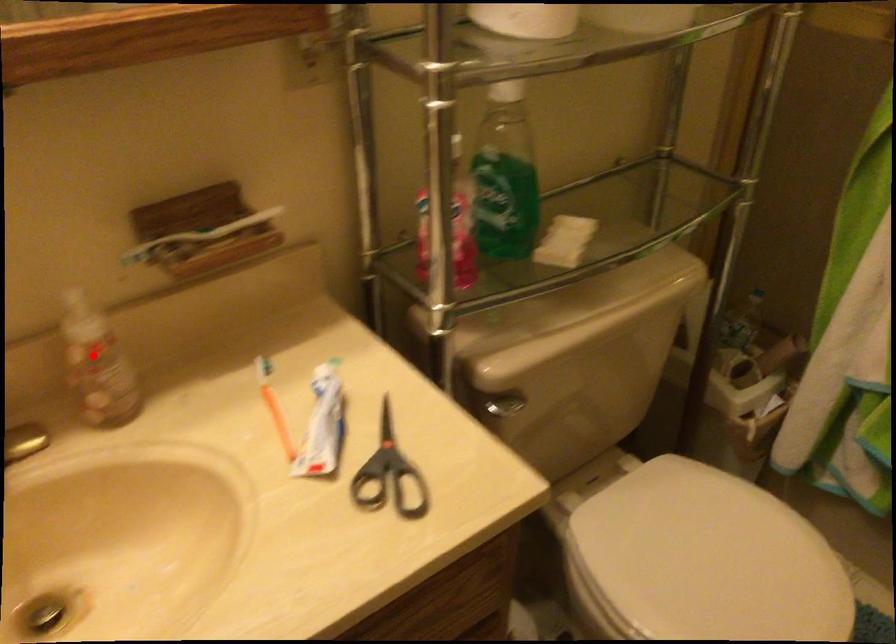
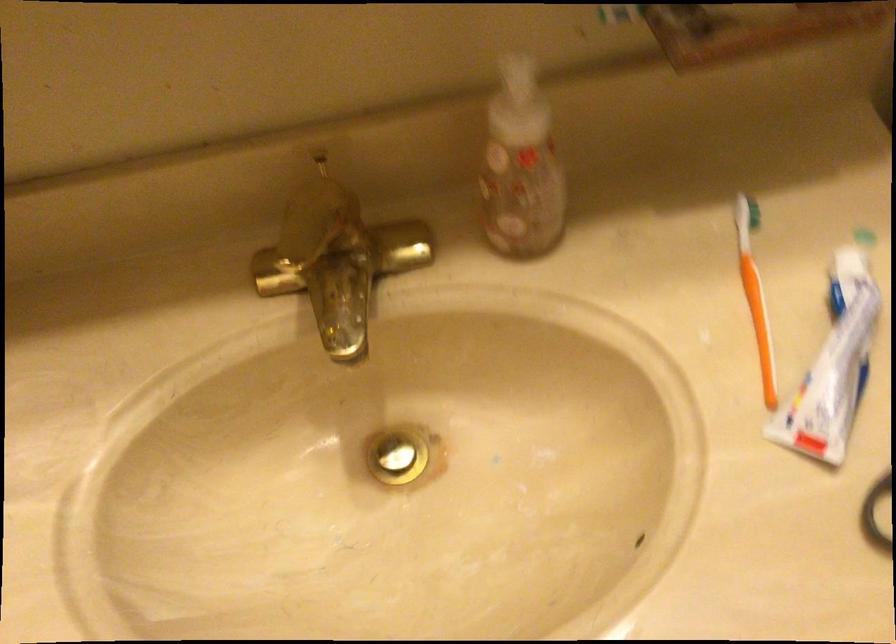
Question: I am providing you with two images of the same scene from different viewpoints. Image1 has a red point marked. In image2, the corresponding 3D location appears at what relative position? Reply with the corresponding letter.

Choices:
 (A) Closer
 (B) Farther

Answer: (A)